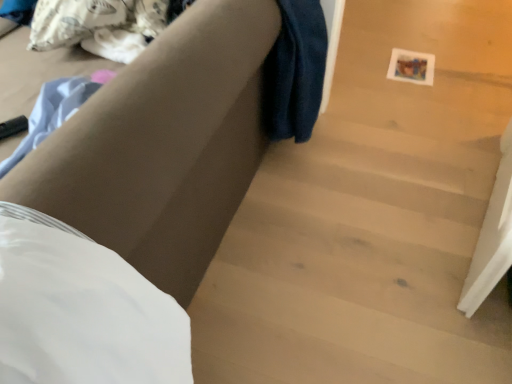
Where is `wooden stairs at center`? The image size is (512, 384). wooden stairs at center is located at coordinates (357, 262).

The image size is (512, 384). Identify the location of wooden stairs at center. (357, 262).

Can you confirm if matte brown couch at center is wider than wooden stairs at center?

No, matte brown couch at center is not wider than wooden stairs at center.

Considering the relative sizes of matte brown couch at center and wooden stairs at center in the image provided, is matte brown couch at center bigger than wooden stairs at center?

Yes, matte brown couch at center is bigger than wooden stairs at center.

Locate an element on the screen. stairwell that appears on the right of matte brown couch at center is located at coordinates (357, 262).

Is matte brown couch at center positioned with its back to wooden stairs at center?

Yes, matte brown couch at center's orientation is away from wooden stairs at center.

From the image's perspective, is white matte sheet at lower left above wooden stairs at center?

No, from the image's perspective, white matte sheet at lower left is not on top of wooden stairs at center.

Relative to wooden stairs at center, is white matte sheet at lower left in front or behind?

Visually, white matte sheet at lower left is located in front of wooden stairs at center.

Is white matte sheet at lower left facing towards wooden stairs at center?

No.

Can you see matte brown couch at center touching white matte sheet at lower left?

No, matte brown couch at center is not with white matte sheet at lower left.

In order to click on sheet lying on the right of matte brown couch at center in this screenshot , I will do `click(81, 310)`.

Which is behind, point (139, 142) or point (5, 243)?

Positioned behind is point (139, 142).

From a real-world perspective, is wooden stairs at center under white matte sheet at lower left?

Yes, from a real-world perspective, wooden stairs at center is beneath white matte sheet at lower left.

Can you confirm if wooden stairs at center is thinner than white matte sheet at lower left?

No, wooden stairs at center is not thinner than white matte sheet at lower left.

Consider the image. Is wooden stairs at center with white matte sheet at lower left?

wooden stairs at center and white matte sheet at lower left are clearly separated.

From the picture: Is wooden stairs at center facing away from white matte sheet at lower left?

wooden stairs at center is not turned away from white matte sheet at lower left.

From a real-world perspective, which is physically below, wooden stairs at center or matte brown couch at center?

In real-world perspective, wooden stairs at center is lower.

Find the location of `furniture that is in front of the wooden stairs at center`. furniture that is in front of the wooden stairs at center is located at coordinates (133, 205).

Looking at their sizes, would you say wooden stairs at center is wider or thinner than matte brown couch at center?

In the image, wooden stairs at center appears to be wider than matte brown couch at center.

Measure the distance from white matte sheet at lower left to matte brown couch at center.

white matte sheet at lower left and matte brown couch at center are 6.12 inches apart.

Considering the positions of points (56, 271) and (170, 277), is point (56, 271) closer to camera compared to point (170, 277)?

Yes, point (56, 271) is closer to viewer.

Is white matte sheet at lower left taller than matte brown couch at center?

No, white matte sheet at lower left is not taller than matte brown couch at center.

Is white matte sheet at lower left positioned before matte brown couch at center?

Yes.

Find the location of `furniture lying above the wooden stairs at center (from the image's perspective)`. furniture lying above the wooden stairs at center (from the image's perspective) is located at coordinates (133, 205).

Where is `sheet on the left of wooden stairs at center`? The height and width of the screenshot is (384, 512). sheet on the left of wooden stairs at center is located at coordinates (81, 310).

Considering their positions, is wooden stairs at center positioned closer to matte brown couch at center than white matte sheet at lower left?

white matte sheet at lower left.

From the image, which object appears to be farther from matte brown couch at center, white matte sheet at lower left or wooden stairs at center?

Based on the image, wooden stairs at center appears to be further to matte brown couch at center.

When comparing their distances from wooden stairs at center, does white matte sheet at lower left or matte brown couch at center seem further?

Based on the image, white matte sheet at lower left appears to be further to wooden stairs at center.

From the image, which object appears to be farther from white matte sheet at lower left, matte brown couch at center or wooden stairs at center?

Based on the image, wooden stairs at center appears to be further to white matte sheet at lower left.

Which object lies nearer to the anchor point white matte sheet at lower left, wooden stairs at center or matte brown couch at center?

Based on the image, matte brown couch at center appears to be nearer to white matte sheet at lower left.

When comparing their distances from wooden stairs at center, does matte brown couch at center or white matte sheet at lower left seem closer?

The object closer to wooden stairs at center is matte brown couch at center.

The width and height of the screenshot is (512, 384). What are the coordinates of `sheet between matte brown couch at center and wooden stairs at center` in the screenshot? It's located at point(81,310).